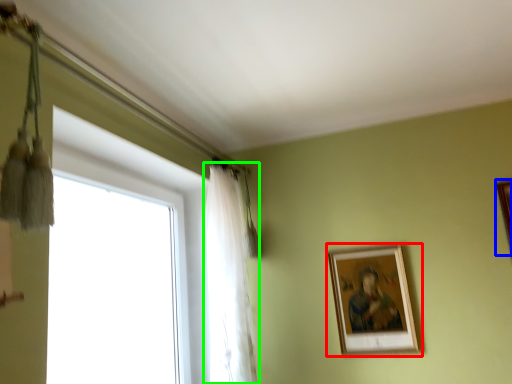
Question: Estimate the real-world distances between objects in this image. Which object is closer to picture frame (highlighted by a red box), picture frame (highlighted by a blue box) or curtain (highlighted by a green box)?

Choices:
 (A) picture frame
 (B) curtain

Answer: (B)